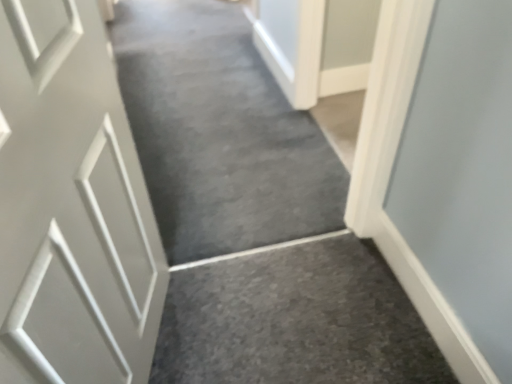
Question: From the image's perspective, is gray carpet at center located beneath white matte door at left?

Choices:
 (A) yes
 (B) no

Answer: (B)

Question: Is gray carpet at center closer to the viewer compared to white matte door at left?

Choices:
 (A) no
 (B) yes

Answer: (A)

Question: From the image's perspective, does gray carpet at center appear higher than white matte door at left?

Choices:
 (A) yes
 (B) no

Answer: (A)

Question: Is gray carpet at center located outside white matte door at left?

Choices:
 (A) yes
 (B) no

Answer: (A)

Question: Can you confirm if gray carpet at center is positioned to the right of white matte door at left?

Choices:
 (A) no
 (B) yes

Answer: (A)

Question: Does gray carpet at center have a larger size compared to white matte door at left?

Choices:
 (A) yes
 (B) no

Answer: (A)

Question: From the image's perspective, is white matte door at left over gray carpet at center?

Choices:
 (A) yes
 (B) no

Answer: (B)

Question: Is white matte door at left facing away from gray carpet at center?

Choices:
 (A) yes
 (B) no

Answer: (B)

Question: Is white matte door at left completely or partially outside of gray carpet at center?

Choices:
 (A) no
 (B) yes

Answer: (B)

Question: Can you confirm if white matte door at left is thinner than gray carpet at center?

Choices:
 (A) no
 (B) yes

Answer: (B)

Question: Does white matte door at left come behind gray carpet at center?

Choices:
 (A) no
 (B) yes

Answer: (A)

Question: Is white matte door at left wider than gray carpet at center?

Choices:
 (A) yes
 (B) no

Answer: (B)

Question: Is gray carpet at center bigger or smaller than white matte door at left?

Choices:
 (A) small
 (B) big

Answer: (B)